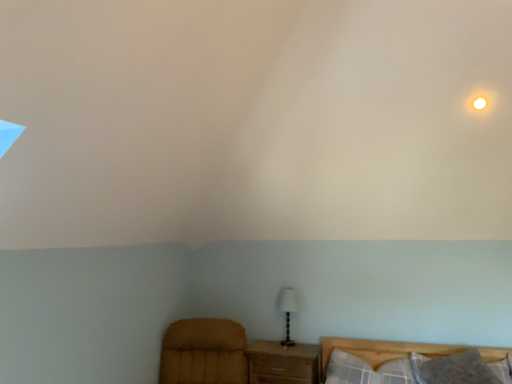
Where is `vacant area that lies in front of white fabric lampshade at center`? vacant area that lies in front of white fabric lampshade at center is located at coordinates (288, 353).